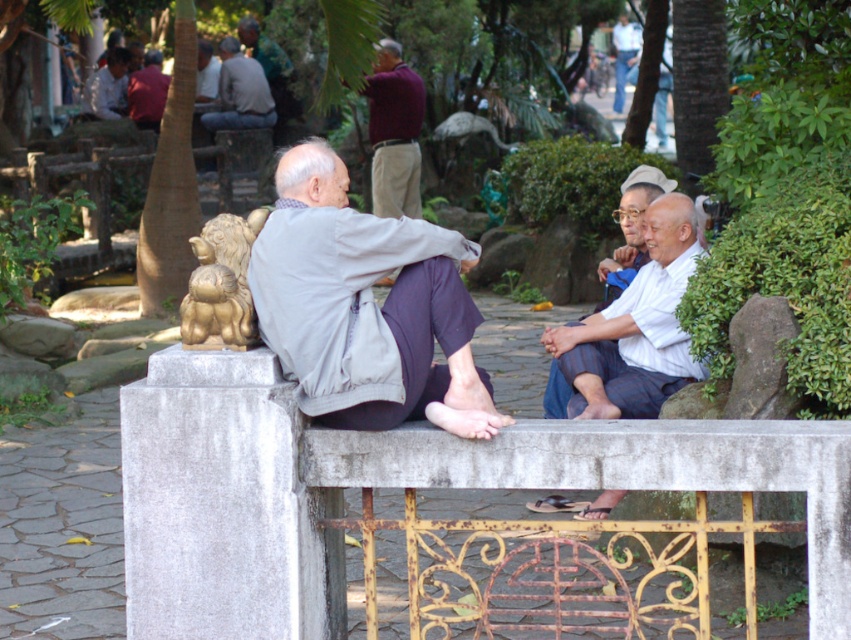
Does maroon sweater at center appear over matte gray shirt at center?

Actually, maroon sweater at center is below matte gray shirt at center.

Locate an element on the screen. The image size is (851, 640). maroon sweater at center is located at coordinates (393, 132).

Which is in front, point (263, 80) or point (634, 61)?

Point (263, 80) is more forward.

Who is positioned more to the right, gray wool sweater at upper left or light blue jeans at upper center?

light blue jeans at upper center

Between point (250, 80) and point (620, 102), which one is positioned behind?

The point (620, 102) is more distant.

Locate an element on the screen. The image size is (851, 640). gray wool sweater at upper left is located at coordinates [238, 92].

Does white striped fabric at right appear on the left side of matte gray shirt at upper left?

In fact, white striped fabric at right is to the right of matte gray shirt at upper left.

Who is more distant from viewer, [672,374] or [96,90]?

The point [96,90] is behind.

The width and height of the screenshot is (851, 640). I want to click on white striped fabric at right, so click(x=632, y=346).